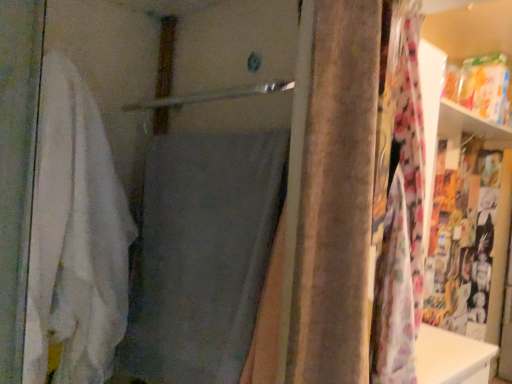
Question: From a real-world perspective, is white soft towel at left, which appears as the 2th bath towel when viewed from the right, positioned over velvet brown curtain at center based on gravity?

Choices:
 (A) yes
 (B) no

Answer: (B)

Question: Could you tell me if white soft towel at left, which appears as the 2th bath towel when viewed from the right, is facing velvet brown curtain at center?

Choices:
 (A) yes
 (B) no

Answer: (A)

Question: Is velvet brown curtain at center completely or partially inside white soft towel at left, which appears as the 2th bath towel when viewed from the right?

Choices:
 (A) yes
 (B) no

Answer: (B)

Question: Can you confirm if white soft towel at left, acting as the first bath towel starting from the left, is positioned to the right of velvet brown curtain at center?

Choices:
 (A) no
 (B) yes

Answer: (A)

Question: From the image's perspective, is white soft towel at left, which appears as the 2th bath towel when viewed from the right, below velvet brown curtain at center?

Choices:
 (A) yes
 (B) no

Answer: (A)

Question: Is white soft towel at left, acting as the first bath towel starting from the left, bigger or smaller than velvet brown curtain at center?

Choices:
 (A) big
 (B) small

Answer: (A)

Question: Considering the positions of point pyautogui.click(x=75, y=185) and point pyautogui.click(x=309, y=284), is point pyautogui.click(x=75, y=185) closer or farther from the camera than point pyautogui.click(x=309, y=284)?

Choices:
 (A) closer
 (B) farther

Answer: (B)

Question: In terms of height, does white soft towel at left, which appears as the 2th bath towel when viewed from the right, look taller or shorter compared to velvet brown curtain at center?

Choices:
 (A) short
 (B) tall

Answer: (B)

Question: From a real-world perspective, is white soft towel at left, which appears as the 2th bath towel when viewed from the right, positioned above or below velvet brown curtain at center?

Choices:
 (A) below
 (B) above

Answer: (A)

Question: Considering the positions of gray fabric bath towel at center, the 2th bath towel positioned from the left, and white soft towel at left, which appears as the 2th bath towel when viewed from the right, in the image, is gray fabric bath towel at center, the 2th bath towel positioned from the left, bigger or smaller than white soft towel at left, which appears as the 2th bath towel when viewed from the right,?

Choices:
 (A) small
 (B) big

Answer: (A)

Question: From a real-world perspective, is gray fabric bath towel at center, the 2th bath towel positioned from the left, above or below white soft towel at left, which appears as the 2th bath towel when viewed from the right?

Choices:
 (A) below
 (B) above

Answer: (A)

Question: Does point (178, 168) appear closer or farther from the camera than point (37, 372)?

Choices:
 (A) farther
 (B) closer

Answer: (A)

Question: In the image, is gray fabric bath towel at center, the 2th bath towel positioned from the left, on the left side or the right side of white soft towel at left, which appears as the 2th bath towel when viewed from the right?

Choices:
 (A) right
 (B) left

Answer: (A)

Question: From a real-world perspective, relative to white soft towel at left, acting as the first bath towel starting from the left, is velvet brown curtain at center vertically above or below?

Choices:
 (A) below
 (B) above

Answer: (B)

Question: From the image's perspective, is velvet brown curtain at center located above or below white soft towel at left, which appears as the 2th bath towel when viewed from the right?

Choices:
 (A) above
 (B) below

Answer: (A)